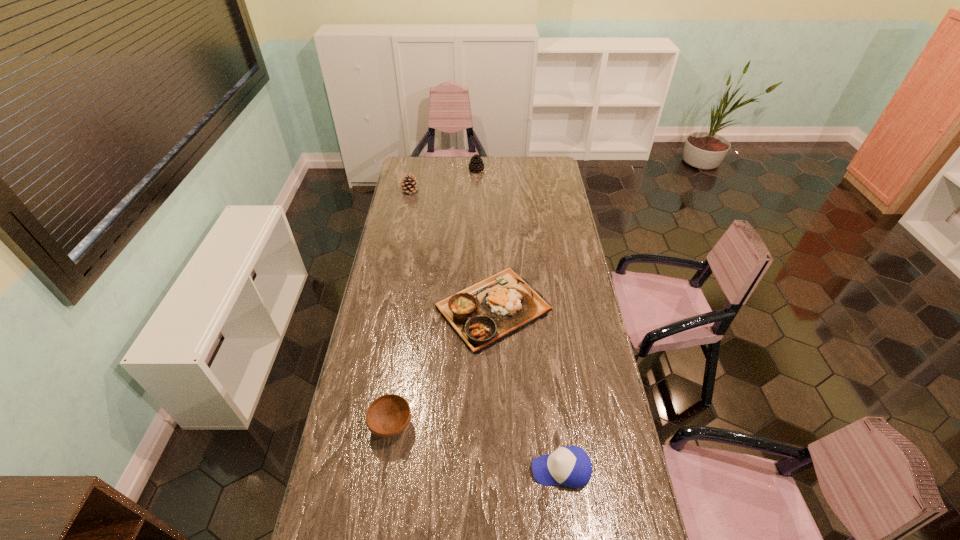
This screenshot has width=960, height=540. Identify the location of vacant region located on the front-facing side of the baseball cap. (490, 469).

Where is `free space located on the front-facing side of the baseball cap`? Image resolution: width=960 pixels, height=540 pixels. free space located on the front-facing side of the baseball cap is located at coordinates (448, 469).

Find the location of a particular element. This screenshot has width=960, height=540. vacant area situated on the front-facing side of the baseball cap is located at coordinates (468, 469).

At what (x,y) coordinates should I click in order to perform the action: click on vacant point located on the right of the bowl. Please return your answer as a coordinate pair (x, y). Looking at the image, I should click on (511, 425).

Where is `object that is at the far edge`? object that is at the far edge is located at coordinates (476, 164).

Locate an element on the screen. pinecone at the left edge is located at coordinates click(409, 185).

Locate an element on the screen. bowl located in the left edge section of the desktop is located at coordinates tap(387, 416).

The width and height of the screenshot is (960, 540). Identify the location of platter that is positioned at the right edge. (482, 315).

You are a GUI agent. You are given a task and a screenshot of the screen. Output one action in this format:
    pyautogui.click(x=<x>, y=<y>)
    Task: Click on the baseball cap that is at the right edge
    The height and width of the screenshot is (540, 960).
    Given the screenshot: What is the action you would take?
    pyautogui.click(x=570, y=466)

The height and width of the screenshot is (540, 960). Identify the location of free region at the far edge of the desktop. (467, 164).